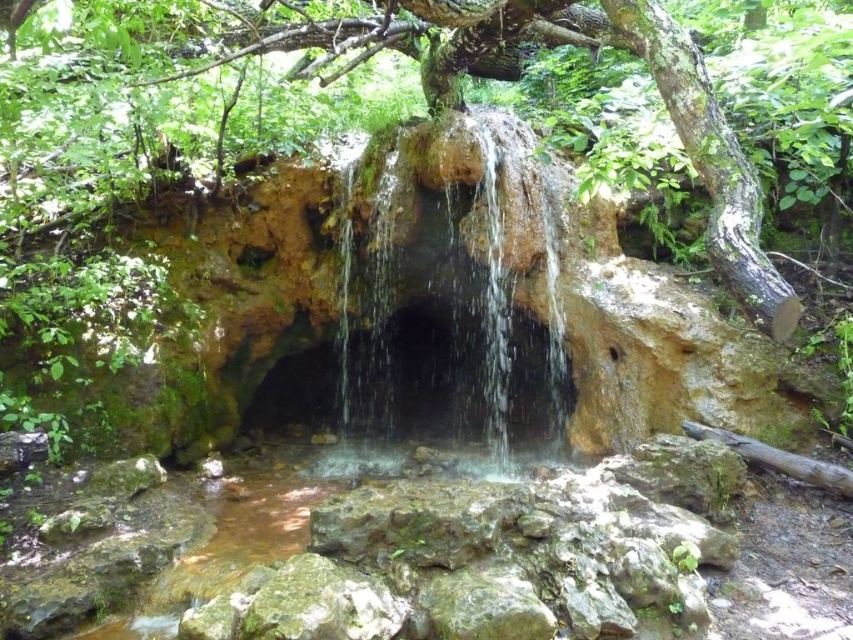
Question: Does green mossy tree at upper center appear on the right side of brown rough log at lower right?

Choices:
 (A) no
 (B) yes

Answer: (A)

Question: Can you confirm if translucent rock waterfall at center is positioned below brown rough log at lower right?

Choices:
 (A) no
 (B) yes

Answer: (A)

Question: Does green mossy tree at upper center have a larger size compared to brown rough log at lower right?

Choices:
 (A) no
 (B) yes

Answer: (B)

Question: Which point appears farthest from the camera in this image?

Choices:
 (A) (473, 202)
 (B) (764, 445)

Answer: (A)

Question: Which of the following is the closest to the observer?

Choices:
 (A) translucent rock waterfall at center
 (B) brown rough log at lower right

Answer: (B)

Question: Which point is farther to the camera?

Choices:
 (A) (492, 406)
 (B) (758, 444)

Answer: (A)